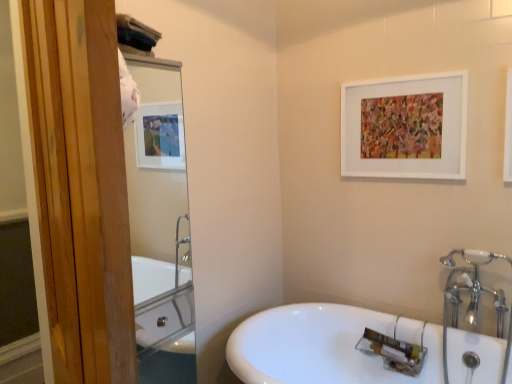
Question: Is white matte picture frame at upper center facing away from clear glass mirror at upper left?

Choices:
 (A) no
 (B) yes

Answer: (A)

Question: Considering the relative positions of white matte picture frame at upper center and clear glass mirror at upper left in the image provided, is white matte picture frame at upper center to the left of clear glass mirror at upper left from the viewer's perspective?

Choices:
 (A) yes
 (B) no

Answer: (B)

Question: Can you confirm if white matte picture frame at upper center is thinner than clear glass mirror at upper left?

Choices:
 (A) no
 (B) yes

Answer: (B)

Question: Considering the relative sizes of white matte picture frame at upper center and clear glass mirror at upper left in the image provided, is white matte picture frame at upper center shorter than clear glass mirror at upper left?

Choices:
 (A) no
 (B) yes

Answer: (B)

Question: Is white matte picture frame at upper center not inside clear glass mirror at upper left?

Choices:
 (A) yes
 (B) no

Answer: (A)

Question: Is white matte picture frame at upper center far away from clear glass mirror at upper left?

Choices:
 (A) no
 (B) yes

Answer: (B)

Question: Considering the relative positions of white ceramic faucet at upper right and white matte picture frame at upper center in the image provided, is white ceramic faucet at upper right behind white matte picture frame at upper center?

Choices:
 (A) yes
 (B) no

Answer: (B)

Question: Is white ceramic faucet at upper right taller than white matte picture frame at upper center?

Choices:
 (A) no
 (B) yes

Answer: (B)

Question: Considering the relative sizes of white ceramic faucet at upper right and white matte picture frame at upper center in the image provided, is white ceramic faucet at upper right bigger than white matte picture frame at upper center?

Choices:
 (A) yes
 (B) no

Answer: (A)

Question: Is white ceramic faucet at upper right outside white matte picture frame at upper center?

Choices:
 (A) yes
 (B) no

Answer: (A)

Question: Can you confirm if white ceramic faucet at upper right is positioned to the right of white matte picture frame at upper center?

Choices:
 (A) no
 (B) yes

Answer: (B)

Question: From a real-world perspective, does white ceramic faucet at upper right sit lower than white matte picture frame at upper center?

Choices:
 (A) no
 (B) yes

Answer: (B)

Question: Can you confirm if white glossy sink at lower center is positioned to the right of white ceramic faucet at upper right?

Choices:
 (A) no
 (B) yes

Answer: (A)